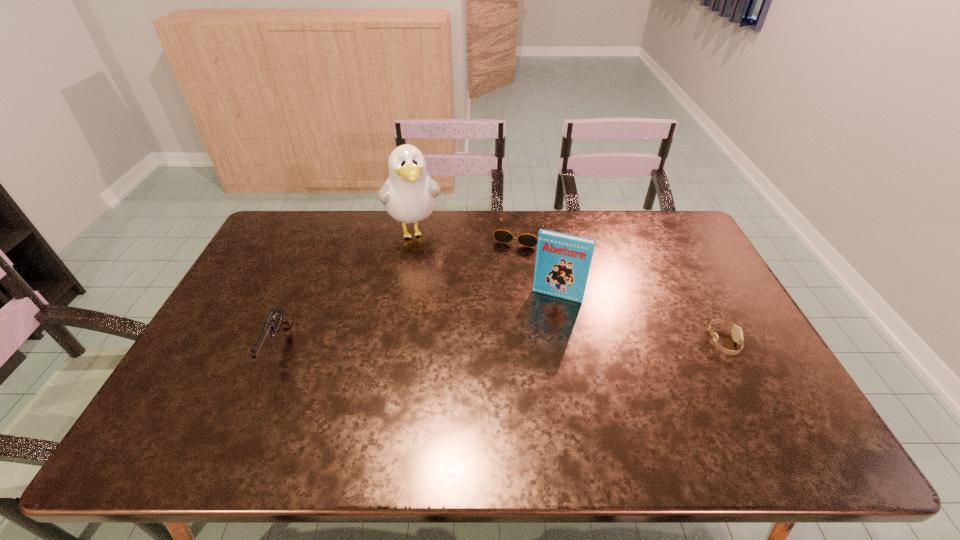
The height and width of the screenshot is (540, 960). I want to click on gull present at the far edge, so click(409, 195).

Where is `object present at the right edge`? The width and height of the screenshot is (960, 540). object present at the right edge is located at coordinates (737, 334).

Find the location of a particular element. This screenshot has width=960, height=540. vacant point at the far edge is located at coordinates (323, 246).

The height and width of the screenshot is (540, 960). Find the location of `free space at the near edge`. free space at the near edge is located at coordinates [412, 402].

This screenshot has width=960, height=540. In the image, there is a desktop. In order to click on vacant area at the left edge in this screenshot , I will do `click(213, 334)`.

Find the location of a particular element. free space at the right edge of the desktop is located at coordinates (745, 340).

In the image, there is a desktop. At what (x,y) coordinates should I click in order to perform the action: click on free space at the far right corner. Please return your answer as a coordinate pair (x, y). The width and height of the screenshot is (960, 540). Looking at the image, I should click on (663, 222).

Locate an element on the screen. This screenshot has height=540, width=960. vacant space at the near right corner of the desktop is located at coordinates (x=748, y=413).

Image resolution: width=960 pixels, height=540 pixels. Find the location of `vacant region between the sunglasses and the watch`. vacant region between the sunglasses and the watch is located at coordinates (621, 288).

At what (x,y) coordinates should I click in order to perform the action: click on vacant space that is in between the watch and the sunglasses. Please return your answer as a coordinate pair (x, y). The height and width of the screenshot is (540, 960). Looking at the image, I should click on (621, 288).